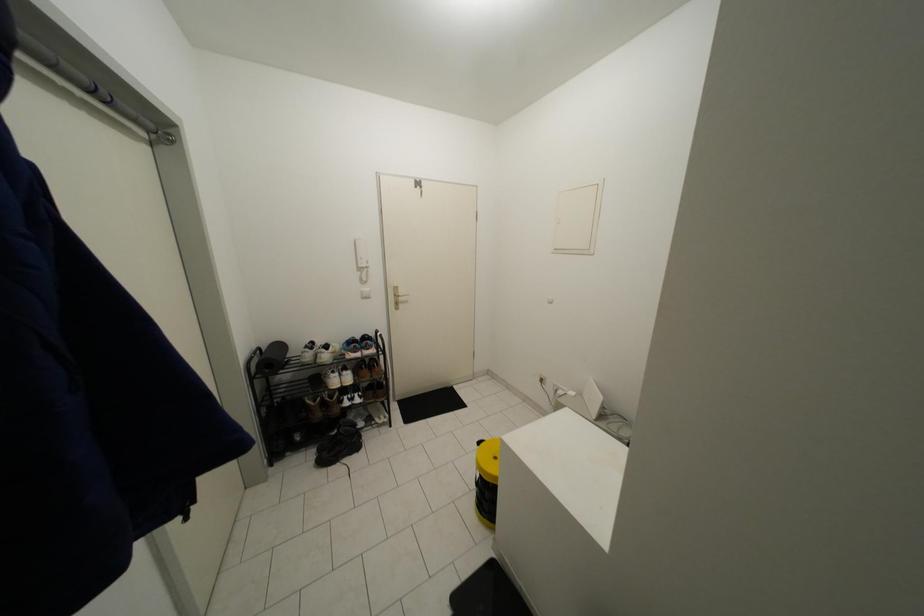
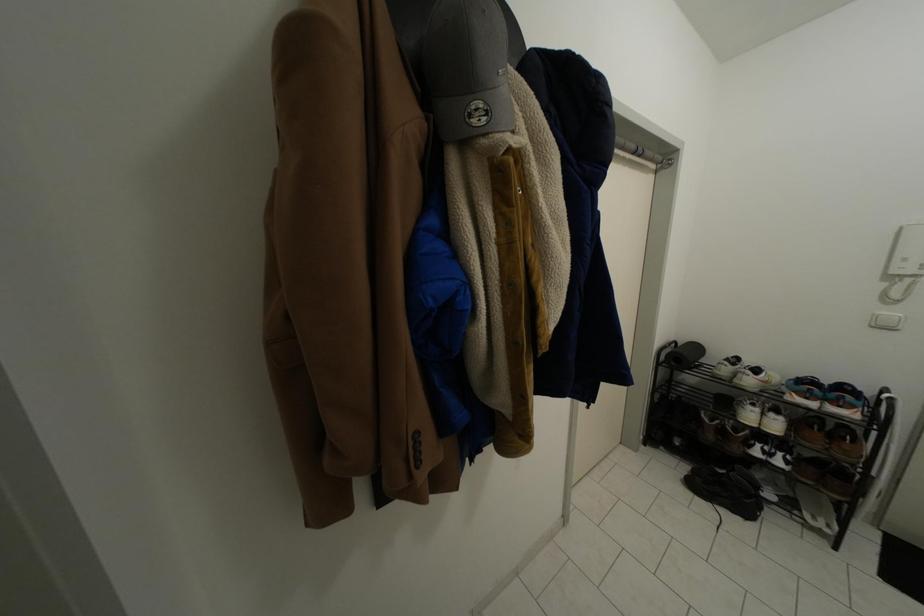
Question: How did the camera likely rotate?

Choices:
 (A) Left
 (B) Right
 (C) Up
 (D) Down

Answer: (A)